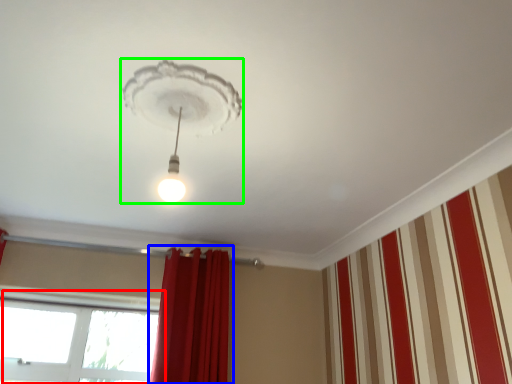
Question: Which object is the closest to the window (highlighted by a red box)? Choose among these: curtain (highlighted by a blue box) or lamp (highlighted by a green box).

Choices:
 (A) curtain
 (B) lamp

Answer: (A)